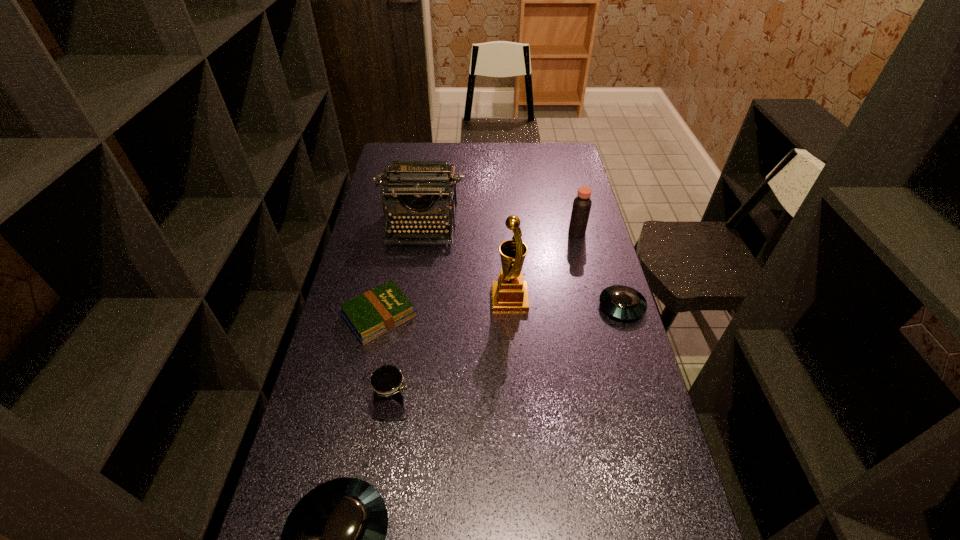
Locate an element on the screen. This screenshot has width=960, height=540. free space for an extra saucer to achieve even spacing is located at coordinates (508, 399).